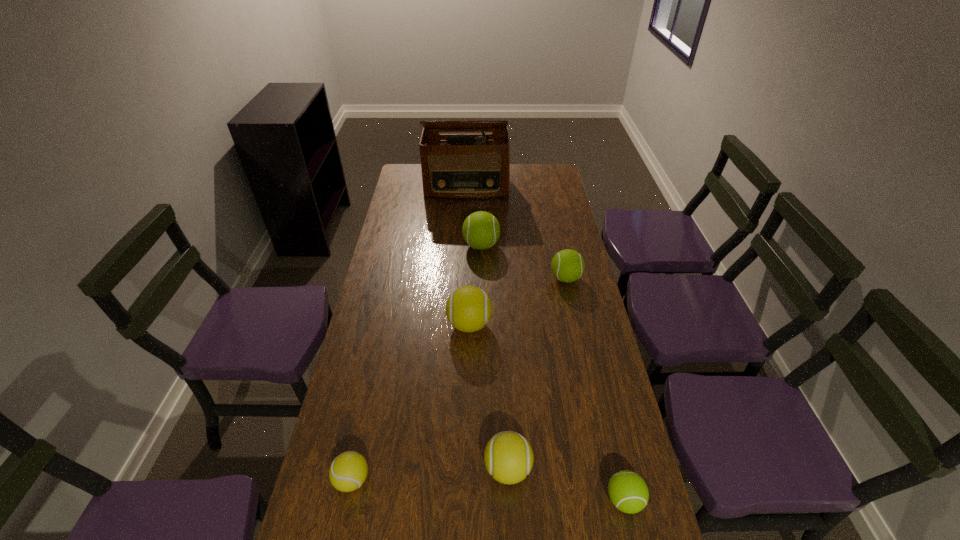
You are a GUI agent. You are given a task and a screenshot of the screen. Output one action in this format:
    pyautogui.click(x=<x>, y=<y>)
    Task: Click on the free space that satisfies the following two spatial constraints: 1. on the front side of the nearest green tennis ball; 2. on the right side of the leftmost green tennis ball
    The height and width of the screenshot is (540, 960).
    Given the screenshot: What is the action you would take?
    pyautogui.click(x=482, y=500)

I want to click on vacant space that satisfies the following two spatial constraints: 1. on the front panel of the tallest object; 2. on the left side of the second smallest green tennis ball, so click(463, 278).